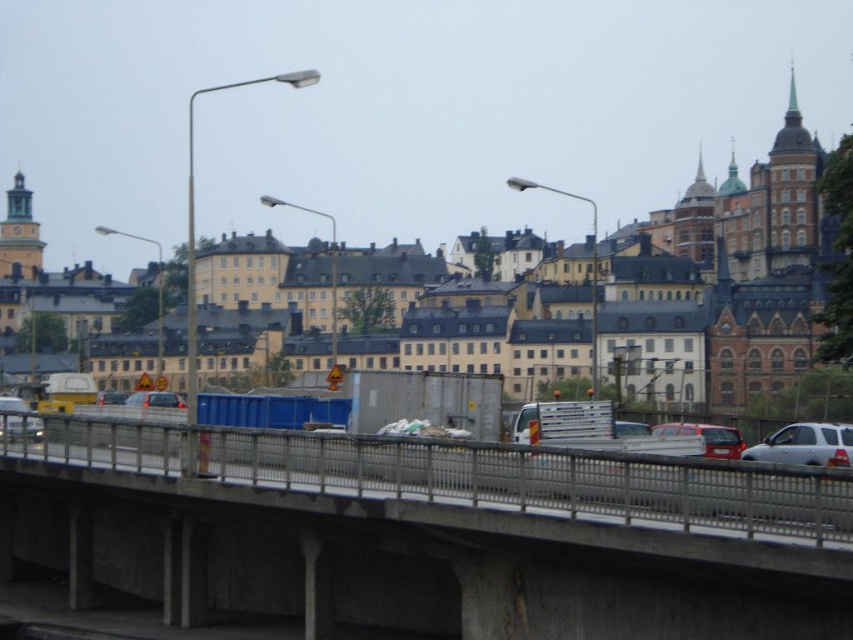
You are a pedestrian trying to cross the bridge. You see the concrete bridge at center and the metallic silver car at center. Which object is closer to you as you approach the bridge?

The concrete bridge at center is closer to you because it is positioned in front of the metallic silver car at center.

You are a delivery driver who needs to cross the concrete bridge at center. There is a metallic silver car at center blocking your path. Can you safely navigate around it to reach the bridge?

The concrete bridge at center is to the right of the metallic silver car at center, so you can safely navigate around the car by moving to the left side to access the bridge.